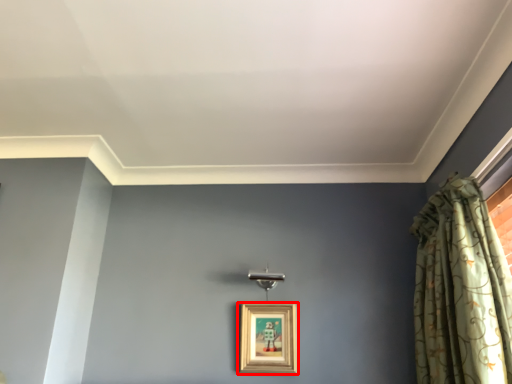
Question: From the image's perspective, considering the relative positions of picture frame (annotated by the red box) and curtain in the image provided, where is picture frame (annotated by the red box) located with respect to the staircase?

Choices:
 (A) above
 (B) below

Answer: (B)